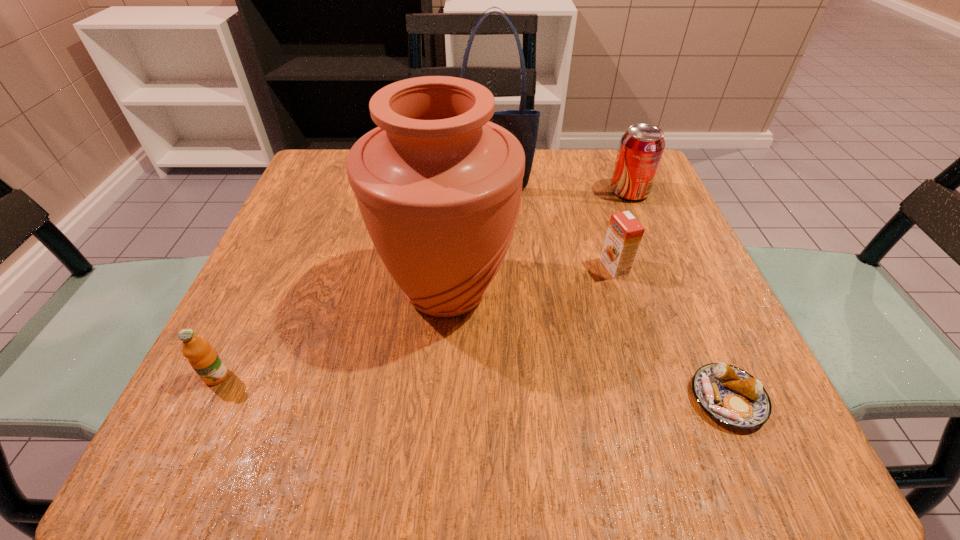
The image size is (960, 540). What are the coordinates of `pastry present at the right edge` in the screenshot? It's located at (730, 395).

Find the location of `object located in the far right corner section of the desktop`. object located in the far right corner section of the desktop is located at coordinates (641, 148).

Where is `object that is at the near right corner`? Image resolution: width=960 pixels, height=540 pixels. object that is at the near right corner is located at coordinates (730, 395).

Find the location of a particular element. free space at the far edge of the desktop is located at coordinates (526, 197).

Where is `free space at the near edge of the desktop`? The height and width of the screenshot is (540, 960). free space at the near edge of the desktop is located at coordinates (372, 438).

At what (x,y) coordinates should I click in order to perform the action: click on free spot at the left edge of the desktop. Please return your answer as a coordinate pair (x, y). Looking at the image, I should click on (330, 221).

The height and width of the screenshot is (540, 960). What are the coordinates of `vacant region at the right edge of the desktop` in the screenshot? It's located at (682, 305).

At what (x,y) coordinates should I click in order to perform the action: click on blank space at the far left corner of the desktop. Please return your answer as a coordinate pair (x, y). The image size is (960, 540). Looking at the image, I should click on pos(346,167).

Where is `free space at the far right corner`? free space at the far right corner is located at coordinates (594, 170).

I want to click on vacant space at the near right corner, so click(763, 453).